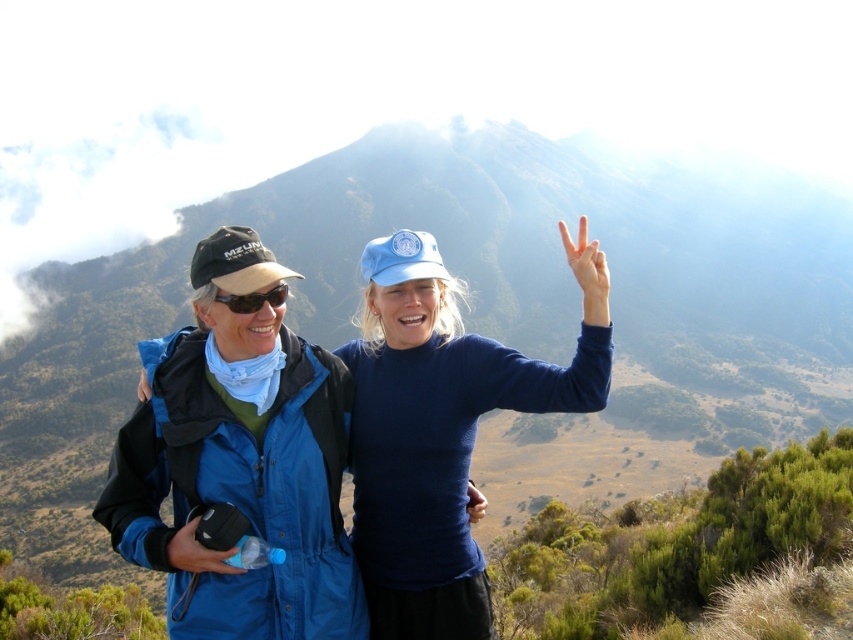
You are a hiker who wants to take a photo of the blue fabric jacket at center from where you are standing. Is the jacket within a 20 meter range of your camera?

The blue fabric jacket at center is 17.36 meters away from the viewer, so yes, it is within the 20 meter range of your camera.

You are a photographer trying to capture a clear shot of the mountain range. You have the blue fabric jacket at center and the matte black goggles at left in your viewfinder. Which object should you adjust your focus on if you want to ensure the larger object is in sharp focus?

The blue fabric jacket at center is larger in size than the matte black goggles at left, so you should focus on the blue fabric jacket at center to ensure the larger object is in sharp focus.